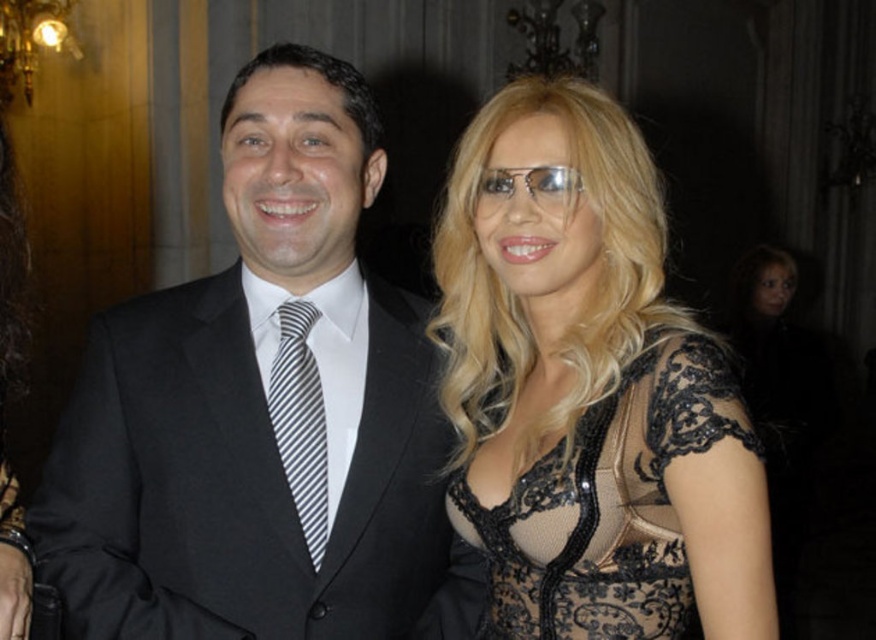
Question: Estimate the real-world distances between objects in this image. Which object is closer to the black lace dress at upper right?

Choices:
 (A) black lace dress at center
 (B) striped fabric tie at center

Answer: (A)

Question: Which point appears closest to the camera in this image?

Choices:
 (A) (281, 344)
 (B) (599, 636)
 (C) (606, 337)

Answer: (B)

Question: Is black satin suit at center bigger than black lace dress at upper right?

Choices:
 (A) no
 (B) yes

Answer: (B)

Question: Which point is closer to the camera?

Choices:
 (A) black lace dress at upper right
 (B) black lace dress at center

Answer: (B)

Question: Is black satin suit at center below black lace dress at upper right?

Choices:
 (A) no
 (B) yes

Answer: (A)

Question: Can you confirm if black satin suit at center is positioned below black lace dress at upper right?

Choices:
 (A) no
 (B) yes

Answer: (A)